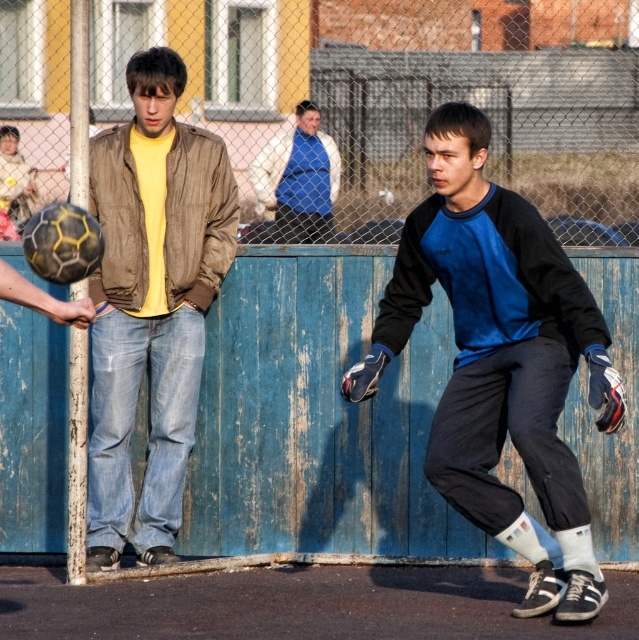
From the picture: You are a referee standing at the center of the soccer field. You need to ensure that the two players wearing the blue velour jacket at center and the matte brown jacket at center are at least 6 feet apart for safety during the game. Based on the scene, are they currently compliant with this safety requirement?

The distance between the blue velour jacket at center and the matte brown jacket at center is 5.02 feet, which is less than the required 6 feet. Therefore, they are not compliant with the safety requirement and need to increase their distance.

You are standing at the point marked as point (427, 61) and want to walk towards the soccer ball in the air. Given that the distance from your current position to the viewer is 8.31 meters, can you estimate how far you need to walk to reach the soccer ball?

The distance from point (427, 61) to the viewer is 8.31 meters. However, the exact distance to the soccer ball cannot be determined without additional information about the ball position relative to the point.

You are a photographer positioned at the origin of the coordinate system. You want to capture a photo that includes both the point at point (350, 122) and point (277, 198). Based on their positions, which point is closer to the camera so that you can focus on it first?

Point (277, 198) is closer to the camera than point (350, 122) because it is in front of it, so you should focus on point (277, 198) first.